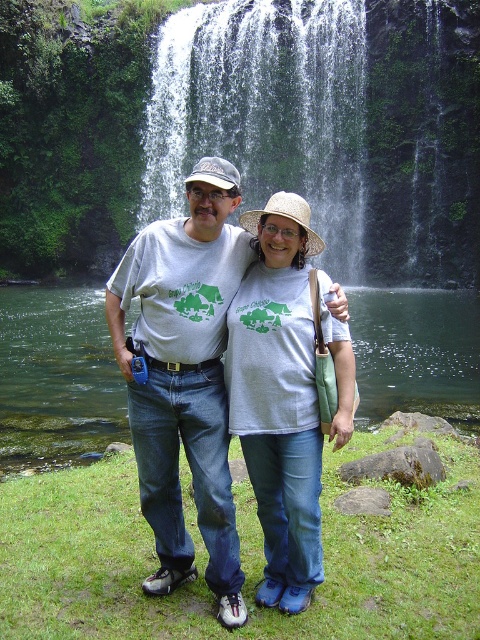
You are standing in front of the waterfall and want to take a photo of the white textured water at center. Where should you aim your camera to capture it?

You should aim your camera at point (265, 109) to capture the white textured water at center.